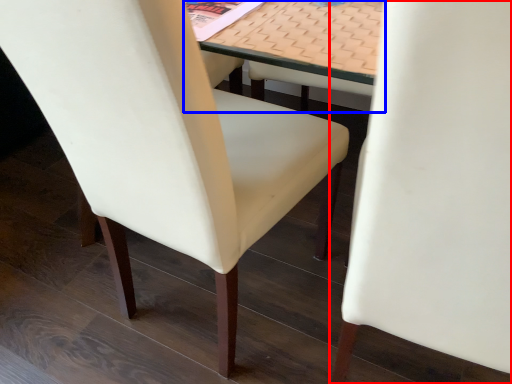
Question: Which object is further to the camera taking this photo, chair (highlighted by a red box) or table (highlighted by a blue box)?

Choices:
 (A) chair
 (B) table

Answer: (B)